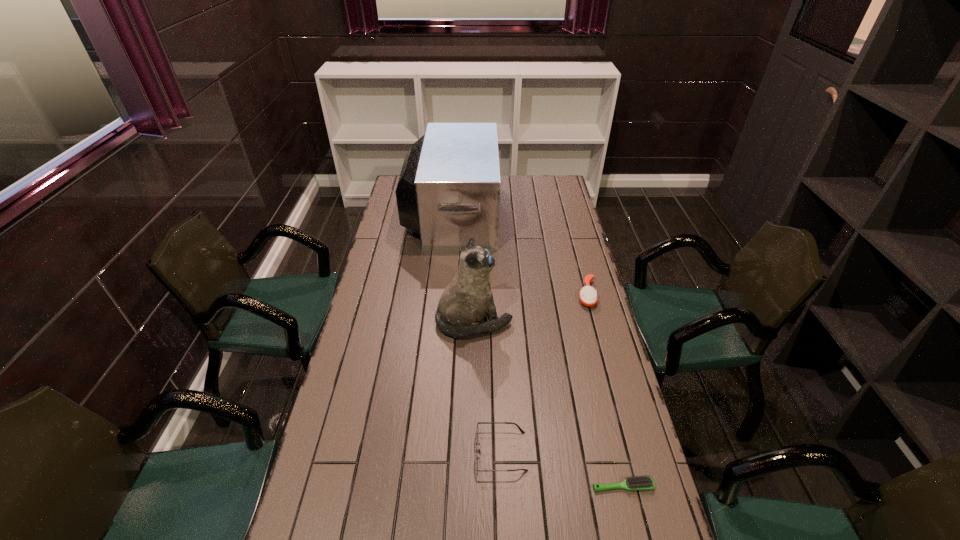
The image size is (960, 540). Identify the location of vacant space located on the front-facing side of the second nearest object. (333, 451).

I want to click on vacant space located 0.160m on the front-facing side of the second nearest object, so click(417, 451).

The width and height of the screenshot is (960, 540). I want to click on free space located on the front-facing side of the second nearest object, so click(355, 451).

Identify the location of free region located on the left of the nearer hairbrush. (438, 486).

Locate an element on the screen. object present at the far edge is located at coordinates (448, 191).

The image size is (960, 540). I want to click on object located in the left edge section of the desktop, so click(x=448, y=191).

At what (x,y) coordinates should I click in order to perform the action: click on object that is at the far left corner. Please return your answer as a coordinate pair (x, y). The width and height of the screenshot is (960, 540). Looking at the image, I should click on (448, 191).

This screenshot has height=540, width=960. In the image, there is a desktop. Find the location of `vacant space at the far edge`. vacant space at the far edge is located at coordinates (503, 191).

This screenshot has height=540, width=960. In the image, there is a desktop. Identify the location of vacant space at the left edge. (379, 239).

Find the location of a particular element. The image size is (960, 540). free space at the right edge of the desktop is located at coordinates (549, 210).